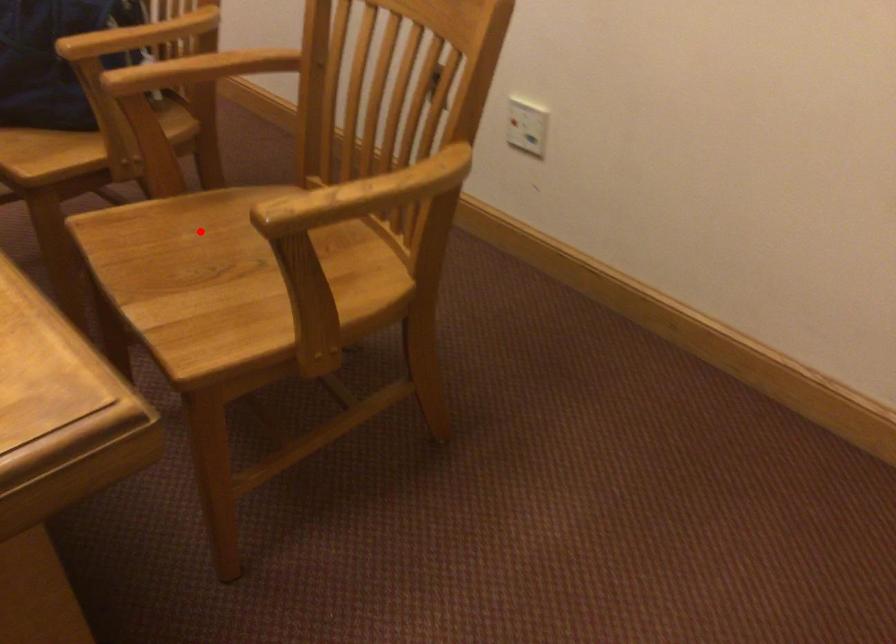
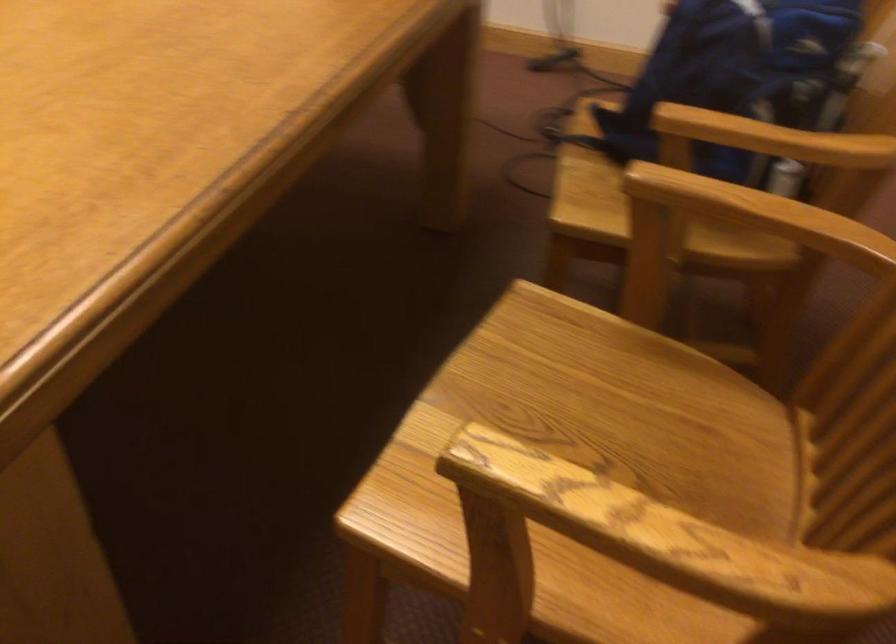
The point at the highlighted location is marked in the first image. Where is the corresponding point in the second image?

(595, 386)